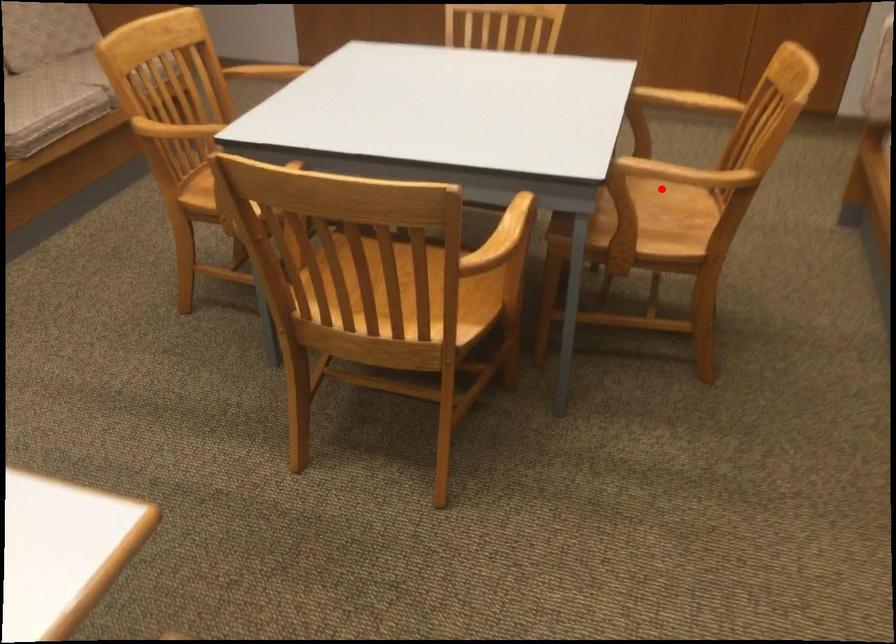
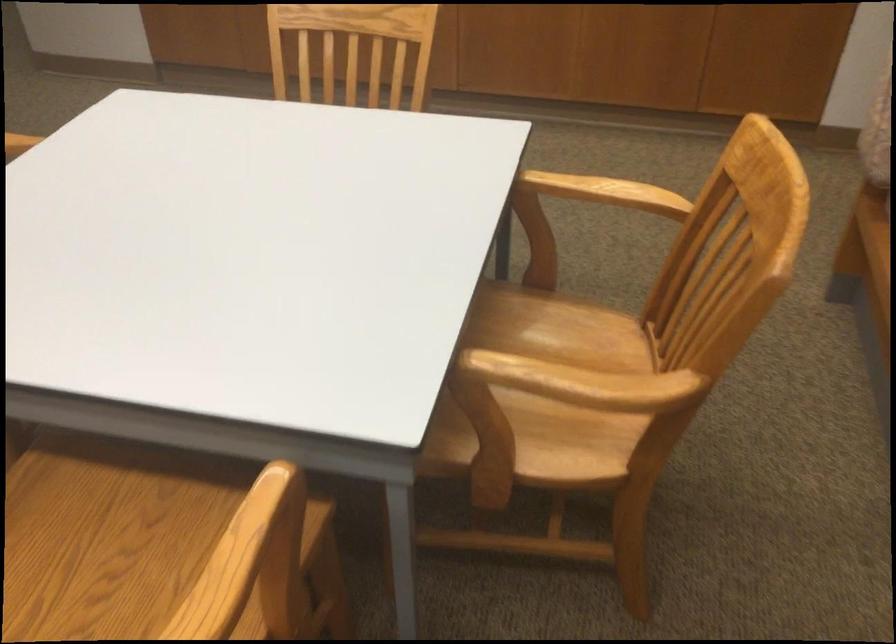
Find the pixel in the second image that matches the highlighted location in the first image.

(567, 330)